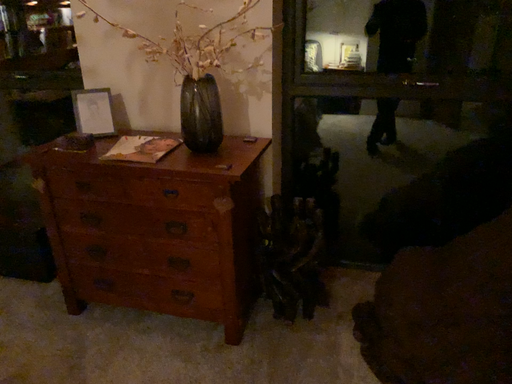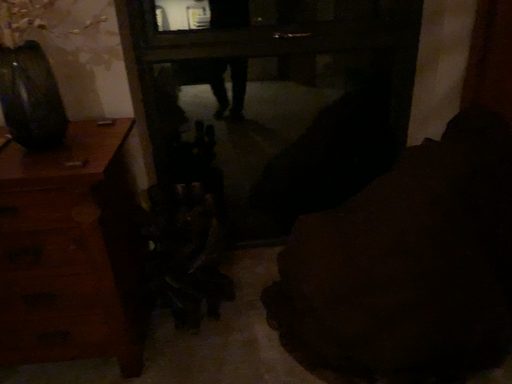
Question: How did the camera likely rotate when shooting the video?

Choices:
 (A) rotated left
 (B) rotated right

Answer: (B)